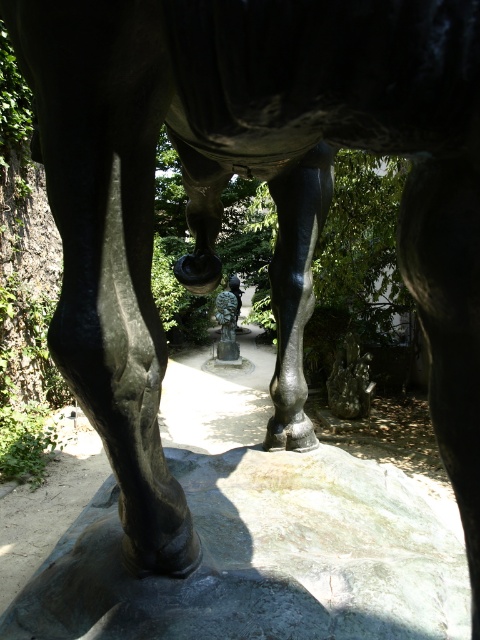
You are a gardener who needs to place a new decorative item in the garden. You have a green stone at center and a bronze statue at center. Which object should you choose if you want to place a larger item in the garden?

The green stone at center is bigger than the bronze statue at center, so you should choose the green stone at center for a larger decorative item.

You are a gardener who wants to place a new plant pot between the green stone at center and the bronze statue at center. Since you want the plant pot to be visible from above, which object should you position it closer to?

The green stone at center has a lesser height compared to bronze statue at center. Position the plant pot closer to the green stone at center so it remains visible from above.